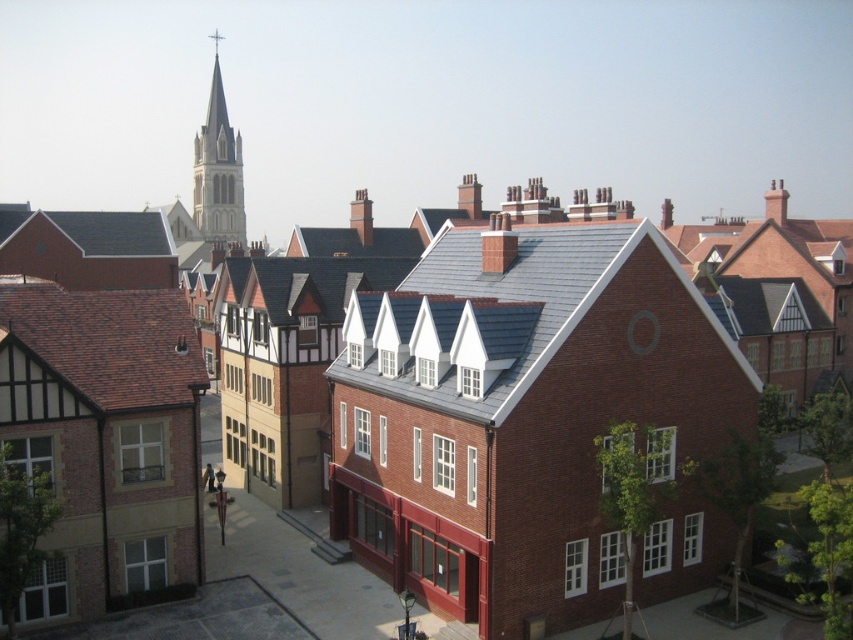
You are an architect analyzing the urban scene. You notice the gray slate roof at center and the smooth white stone spire at upper center. Which of these two structures is located higher in the image?

The smooth white stone spire at upper center is positioned higher than the gray slate roof at center.

You are standing in the courtyard and want to walk from the brick building at center to the nearest building. How far will you have to walk?

The brick building at center is 118.30 feet away from the nearest building, so you will have to walk 118.30 feet to reach it.

You are standing at the origin point of the coordinate system in the image. You want to walk to the brick building at center. Which direction should you move in?

Since the brick building at center is located at coordinate point (520, 413), you should move towards the positive x and y directions to reach it.